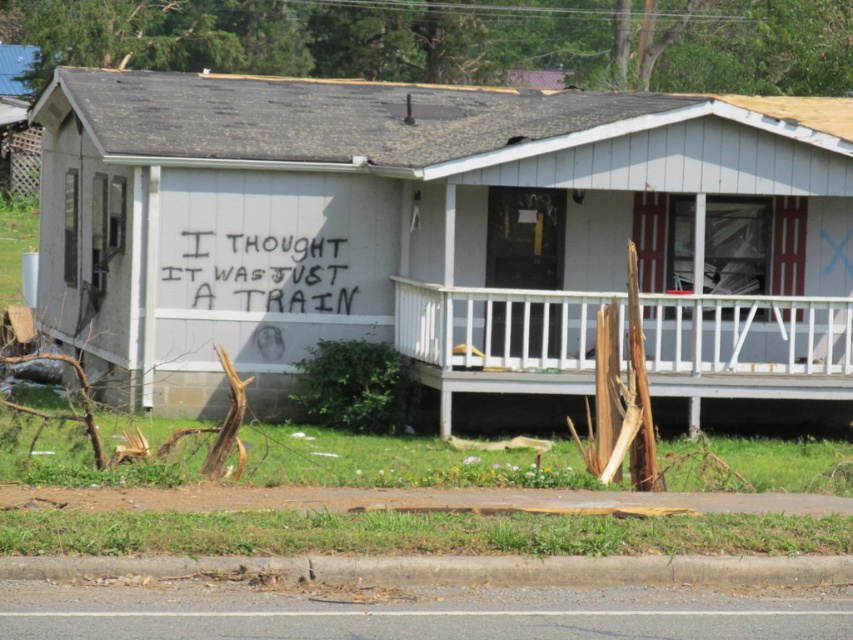
Does point (796, 301) come in front of point (167, 268)?

Yes, point (796, 301) is in front of point (167, 268).

Is white wooden porch at lower center bigger than black spray paint graffiti at center?

Yes.

The image size is (853, 640). Find the location of `white wooden porch at lower center`. white wooden porch at lower center is located at coordinates (500, 339).